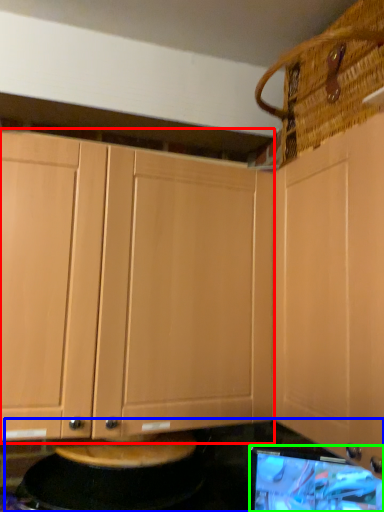
Question: Which object is positioned closest to cabinetry (highlighted by a red box)? Select from counter top (highlighted by a blue box) and computer monitor (highlighted by a green box).

Choices:
 (A) counter top
 (B) computer monitor

Answer: (A)